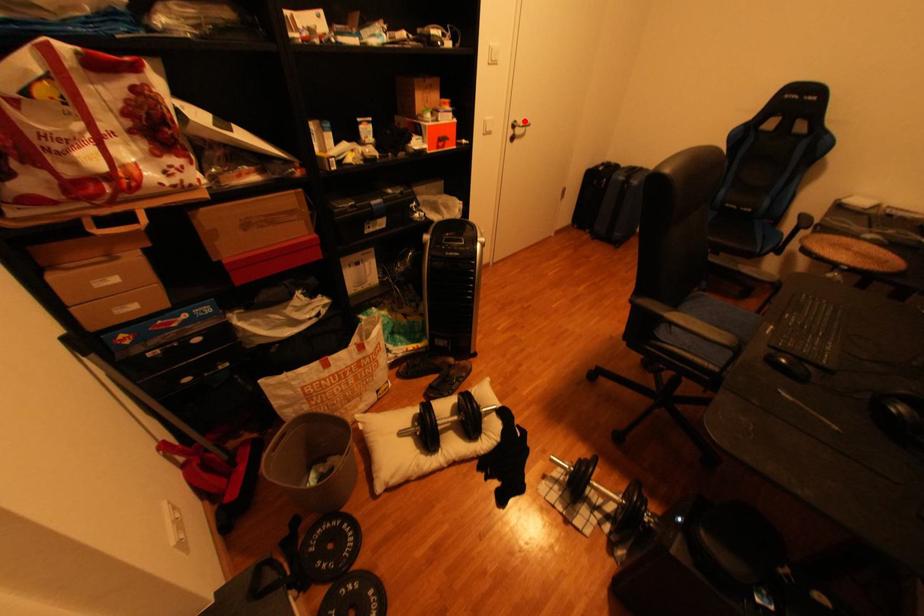
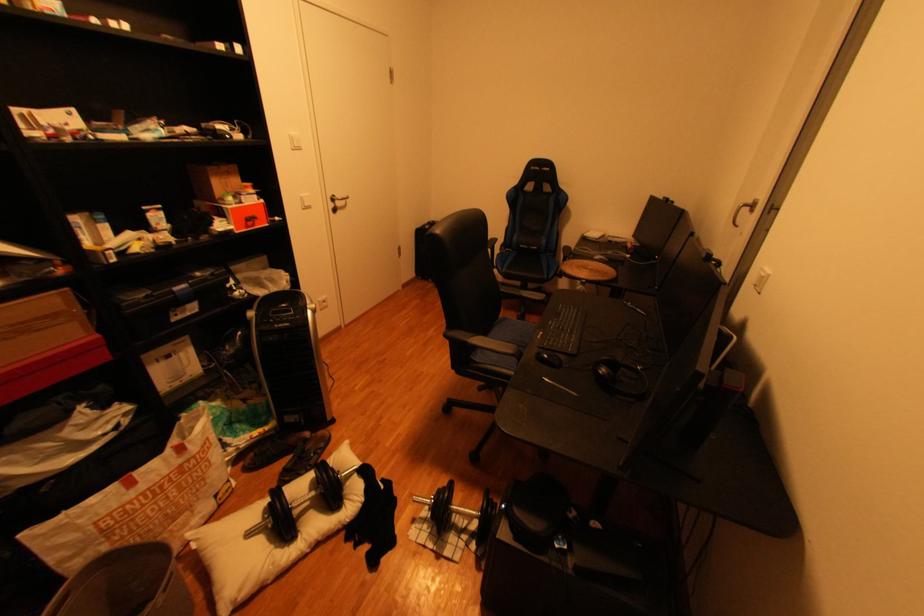
Locate, in the second image, the point that corresponds to the highlighted location in the first image.

(345, 197)